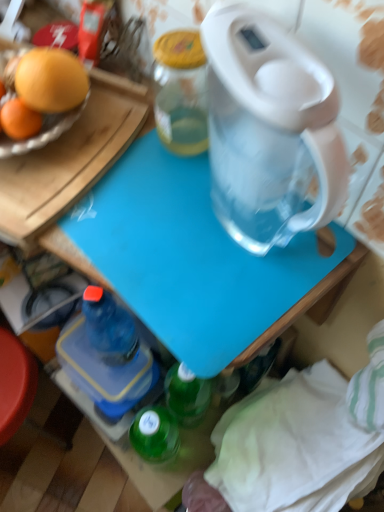
Question: From a real-world perspective, is blue plastic cutting board at center beneath blue plastic bottle at lower left?

Choices:
 (A) no
 (B) yes

Answer: (A)

Question: Considering the relative positions of blue plastic cutting board at center and blue plastic bottle at lower left in the image provided, is blue plastic cutting board at center to the left of blue plastic bottle at lower left from the viewer's perspective?

Choices:
 (A) yes
 (B) no

Answer: (B)

Question: Is blue plastic bottle at lower left inside blue plastic cutting board at center?

Choices:
 (A) no
 (B) yes

Answer: (A)

Question: Does blue plastic cutting board at center have a greater height compared to blue plastic bottle at lower left?

Choices:
 (A) no
 (B) yes

Answer: (B)

Question: Does blue plastic cutting board at center appear on the right side of blue plastic bottle at lower left?

Choices:
 (A) no
 (B) yes

Answer: (B)

Question: Is blue plastic cutting board at center closer to camera compared to blue plastic bottle at lower left?

Choices:
 (A) no
 (B) yes

Answer: (B)

Question: Can you confirm if blue plastic bottle at lower left is bigger than blue plastic cutting board at center?

Choices:
 (A) no
 (B) yes

Answer: (A)

Question: Can you confirm if blue plastic bottle at lower left is smaller than blue plastic cutting board at center?

Choices:
 (A) yes
 (B) no

Answer: (A)

Question: Would you say blue plastic bottle at lower left is a long distance from blue plastic cutting board at center?

Choices:
 (A) no
 (B) yes

Answer: (A)

Question: Is blue plastic bottle at lower left to the left of blue plastic cutting board at center from the viewer's perspective?

Choices:
 (A) no
 (B) yes

Answer: (B)

Question: Could blue plastic cutting board at center be considered to be inside blue plastic bottle at lower left?

Choices:
 (A) yes
 (B) no

Answer: (B)

Question: Does blue plastic bottle at lower left turn towards blue plastic cutting board at center?

Choices:
 (A) no
 (B) yes

Answer: (A)

Question: From the image's perspective, relative to blue plastic cutting board at center, is blue plastic bottle at lower left above or below?

Choices:
 (A) above
 (B) below

Answer: (B)